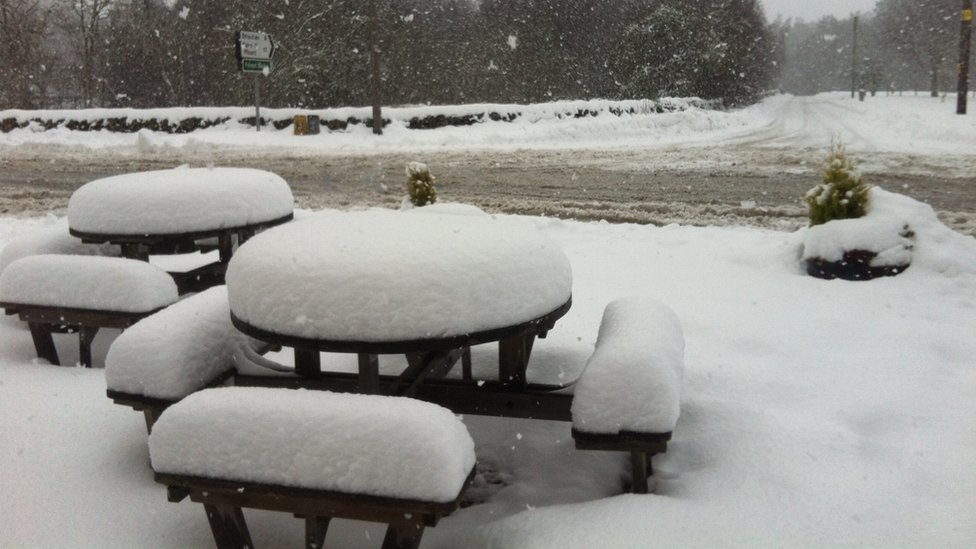
Identify the location of table. (422, 310).